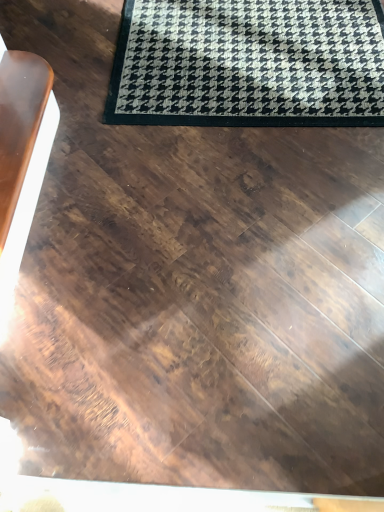
What do you see at coordinates (248, 63) in the screenshot?
I see `black and white textured mat at upper center` at bounding box center [248, 63].

Find the location of a particular element. black and white textured mat at upper center is located at coordinates (248, 63).

Find the location of a particular element. black and white textured mat at upper center is located at coordinates (248, 63).